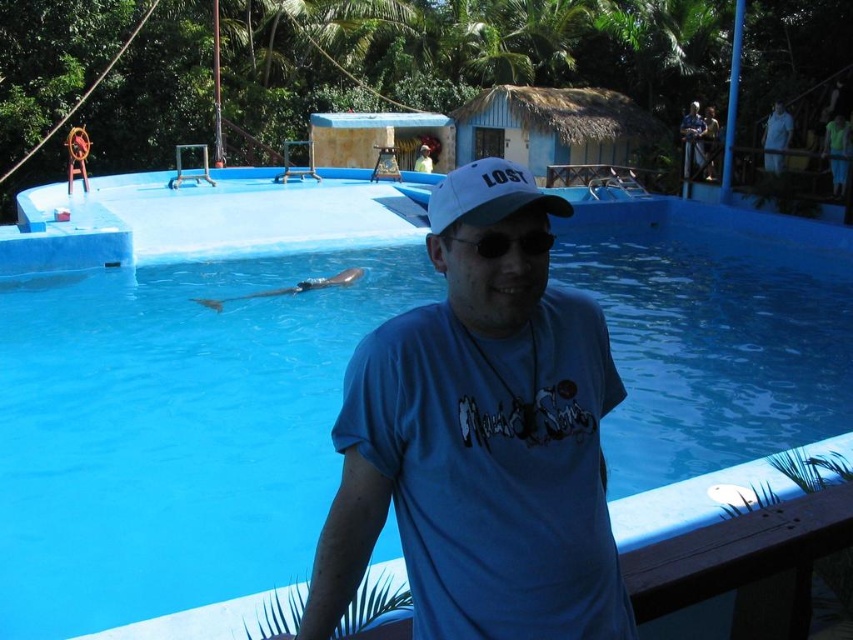
Question: Can you confirm if blue smooth water at center is smaller than black plastic goggles at center?

Choices:
 (A) no
 (B) yes

Answer: (A)

Question: Does blue smooth water at center appear under blue cotton shirt at center?

Choices:
 (A) no
 (B) yes

Answer: (A)

Question: Which is farther from the blue smooth water at center?

Choices:
 (A) black plastic goggles at center
 (B) white fabric cap at center

Answer: (A)

Question: Estimate the real-world distances between objects in this image. Which object is farther from the white fabric cap at center?

Choices:
 (A) black plastic goggles at center
 (B) blue smooth water at center
 (C) blue cotton shirt at center

Answer: (B)

Question: Among these objects, which one is farthest from the camera?

Choices:
 (A) black plastic goggles at center
 (B) blue cotton shirt at center
 (C) white fabric cap at center

Answer: (C)

Question: Considering the relative positions of blue smooth water at center and blue cotton shirt at center in the image provided, where is blue smooth water at center located with respect to blue cotton shirt at center?

Choices:
 (A) below
 (B) above

Answer: (B)